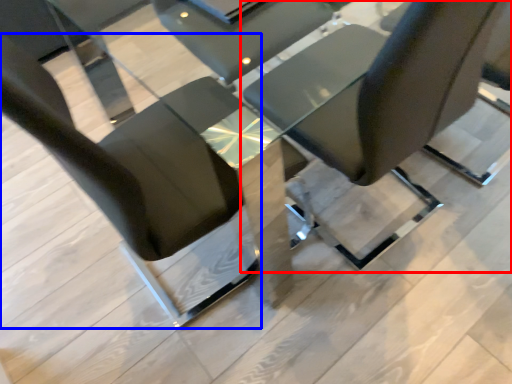
Question: Which point is closer to the camera, chair (highlighted by a red box) or chair (highlighted by a blue box)?

Choices:
 (A) chair
 (B) chair

Answer: (B)